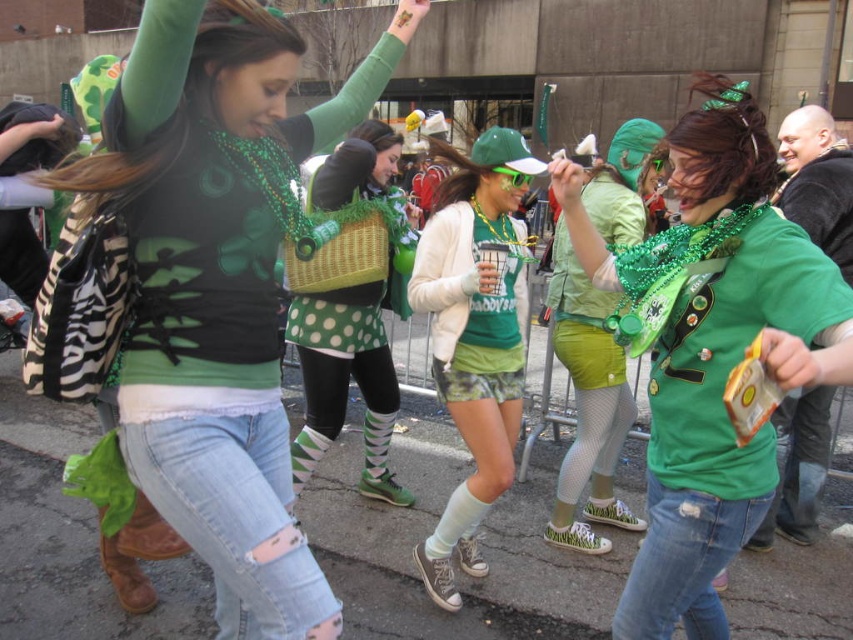
Who is lower down, matte green shorts at center or polka dot leggings at center?

Positioned lower is matte green shorts at center.

Is point (445, 308) positioned behind point (300, 480)?

That is False.

Is point (488, 426) farther from camera compared to point (368, 209)?

No, it is not.

This screenshot has width=853, height=640. I want to click on matte green shorts at center, so click(x=474, y=333).

Is green matte shirt at center to the left of polka dot leggings at center from the viewer's perspective?

Incorrect, green matte shirt at center is not on the left side of polka dot leggings at center.

Is green matte shirt at center positioned before polka dot leggings at center?

Yes, it is in front of polka dot leggings at center.

Is point (791, 237) positioned behind point (328, 339)?

No, it is not.

Where is `green matte shirt at center`? This screenshot has height=640, width=853. green matte shirt at center is located at coordinates (712, 349).

Can you confirm if green matte shirt at center is positioned above green matte shorts at center?

Incorrect, green matte shirt at center is not positioned above green matte shorts at center.

This screenshot has width=853, height=640. In order to click on green matte shirt at center in this screenshot , I will do `click(712, 349)`.